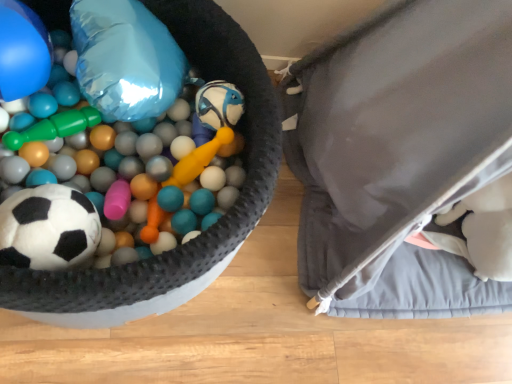
Question: Is gray fabric bean bag chair at right behind blue glossy balloon at upper left, the second balloon in the right-to-left sequence?

Choices:
 (A) no
 (B) yes

Answer: (A)

Question: Is gray fabric bean bag chair at right at the right side of blue glossy balloon at upper left, which is the first balloon in left-to-right order?

Choices:
 (A) no
 (B) yes

Answer: (B)

Question: Is the position of gray fabric bean bag chair at right less distant than that of blue glossy balloon at upper left, which is the first balloon in left-to-right order?

Choices:
 (A) yes
 (B) no

Answer: (A)

Question: From the image's perspective, is gray fabric bean bag chair at right beneath blue glossy balloon at upper left, the second balloon in the right-to-left sequence?

Choices:
 (A) no
 (B) yes

Answer: (B)

Question: Is gray fabric bean bag chair at right not inside blue glossy balloon at upper left, which is the first balloon in left-to-right order?

Choices:
 (A) no
 (B) yes

Answer: (B)

Question: Can you confirm if gray fabric bean bag chair at right is wider than blue glossy balloon at upper left, the second balloon in the right-to-left sequence?

Choices:
 (A) yes
 (B) no

Answer: (A)

Question: Does soft plush soccer ball at left turn towards gray fabric bean bag chair at right?

Choices:
 (A) no
 (B) yes

Answer: (A)

Question: From a real-world perspective, is soft plush soccer ball at left positioned over gray fabric bean bag chair at right based on gravity?

Choices:
 (A) yes
 (B) no

Answer: (B)

Question: Is soft plush soccer ball at left shorter than gray fabric bean bag chair at right?

Choices:
 (A) no
 (B) yes

Answer: (B)

Question: Can you confirm if soft plush soccer ball at left is taller than gray fabric bean bag chair at right?

Choices:
 (A) yes
 (B) no

Answer: (B)

Question: Can you confirm if soft plush soccer ball at left is positioned to the left of gray fabric bean bag chair at right?

Choices:
 (A) yes
 (B) no

Answer: (A)

Question: Is soft plush soccer ball at left wider than gray fabric bean bag chair at right?

Choices:
 (A) yes
 (B) no

Answer: (B)

Question: Is blue glossy balloon at upper left, which is the first balloon in left-to-right order, at the right side of shiny metallic balloon at upper left, which is the second balloon in left-to-right order?

Choices:
 (A) yes
 (B) no

Answer: (B)